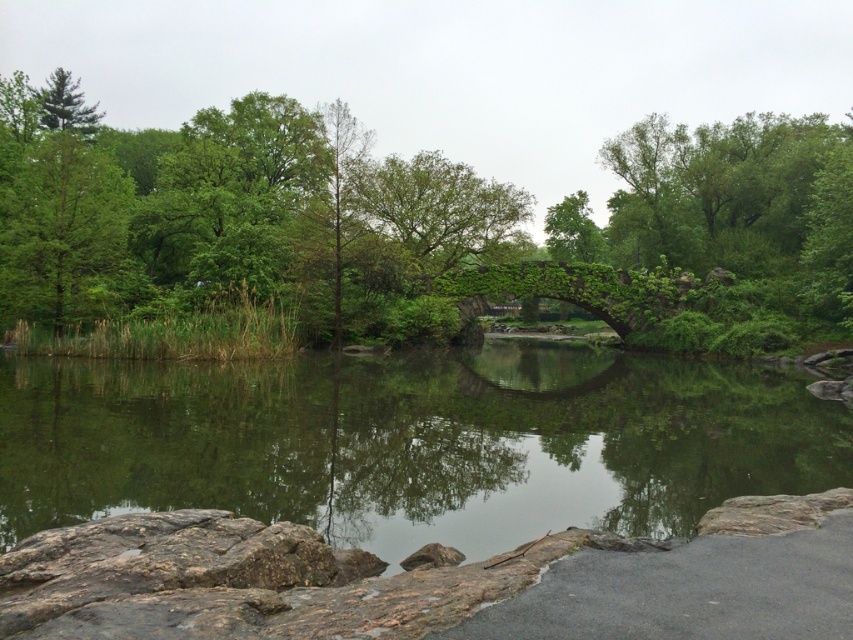
Consider the image. Can you confirm if green leafy tree at left is positioned to the left of green leafy tree at upper left?

In fact, green leafy tree at left is to the right of green leafy tree at upper left.

Is point (22, 156) positioned after point (35, 93)?

No, it is in front of (35, 93).

Between point (30, 150) and point (57, 77), which one is positioned in front?

Point (30, 150) is in front.

Where is `green leafy tree at left`? This screenshot has width=853, height=640. green leafy tree at left is located at coordinates (61, 227).

Is green reflective water at center positioned before green leafy tree at upper left?

That is True.

Consider the image. Which is below, green reflective water at center or green leafy tree at upper left?

Positioned lower is green reflective water at center.

Between point (99, 486) and point (70, 125), which one is positioned in front?

Positioned in front is point (99, 486).

Find the location of `green reflective water at center`. green reflective water at center is located at coordinates (413, 442).

Find the location of a particular element. Image resolution: width=853 pixels, height=640 pixels. green leafy tree at center is located at coordinates (427, 227).

Does green leafy tree at center have a larger size compared to green ivy-covered bridge at center?

Correct, green leafy tree at center is larger in size than green ivy-covered bridge at center.

Is point (287, 275) positioned behind point (656, 300)?

No, it is in front of (656, 300).

In order to click on green leafy tree at center in this screenshot , I will do `click(427, 227)`.